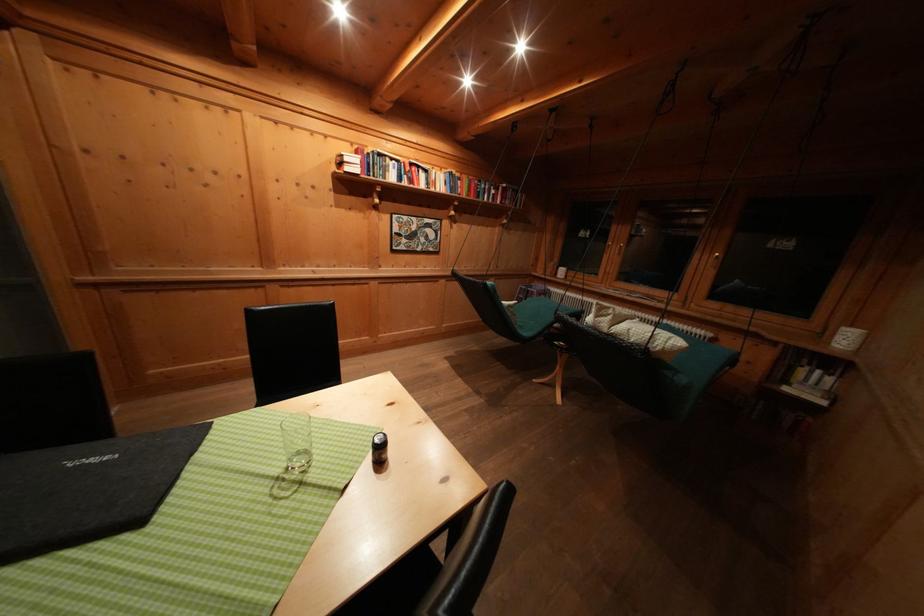
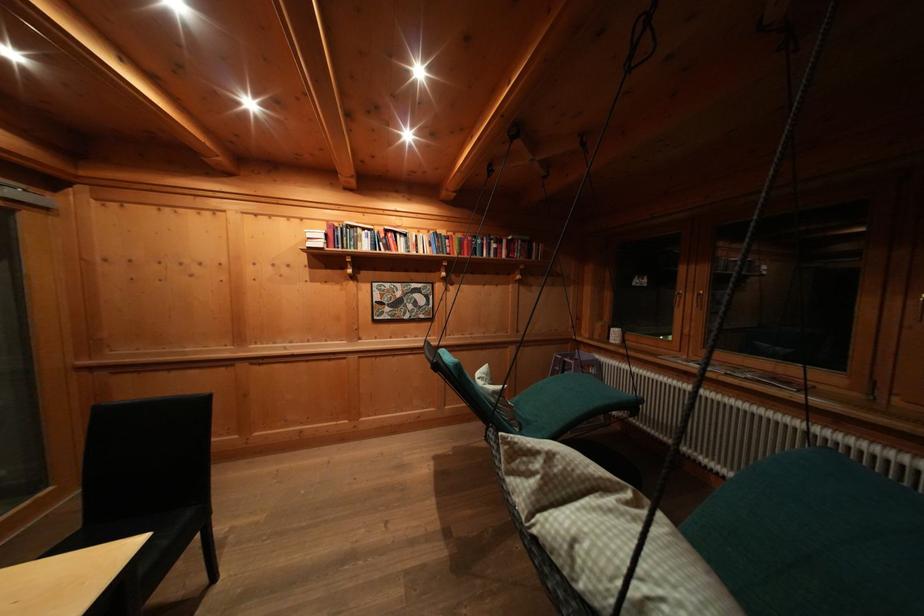
What movement of the cameraman would produce the second image?

The cameraman walked toward right, forward.